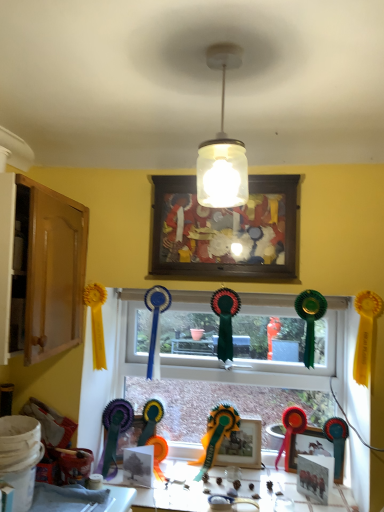
Where is `free space in front of wooden photo frame at center, arranged as the second picture frame when viewed from the top`? free space in front of wooden photo frame at center, arranged as the second picture frame when viewed from the top is located at coordinates [x=238, y=482].